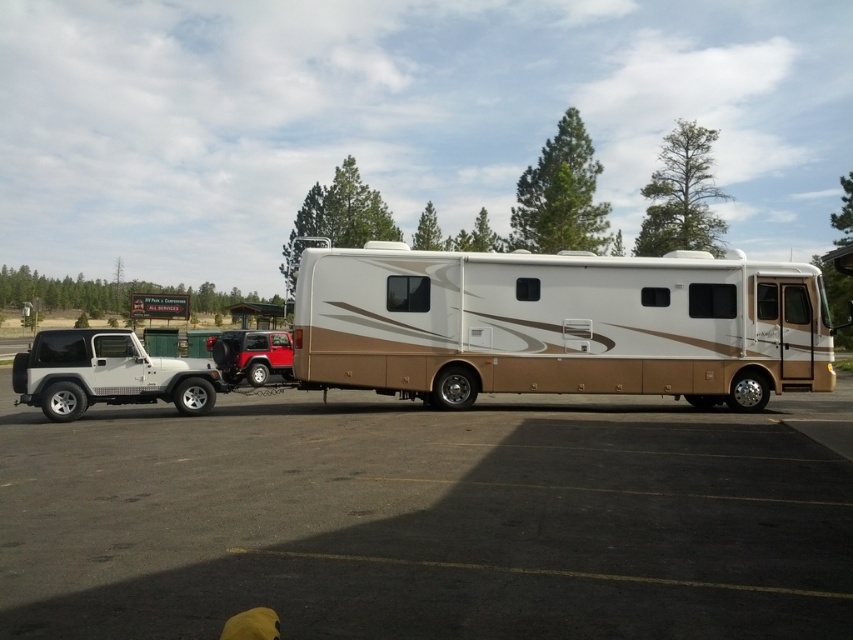
The width and height of the screenshot is (853, 640). What are the coordinates of `matte brown rv at center` in the screenshot? It's located at (558, 324).

Who is positioned more to the left, matte brown rv at center or metallic red suv at left?

metallic red suv at left is more to the left.

What do you see at coordinates (558, 324) in the screenshot? I see `matte brown rv at center` at bounding box center [558, 324].

Image resolution: width=853 pixels, height=640 pixels. What are the coordinates of `matte brown rv at center` in the screenshot? It's located at (558, 324).